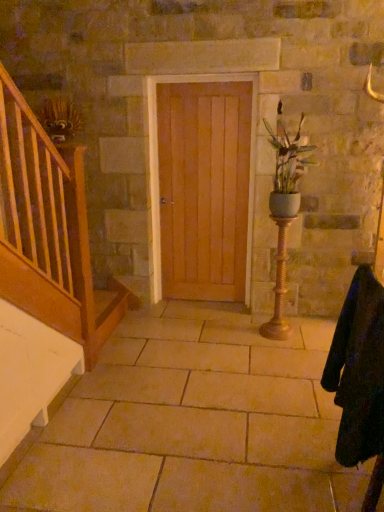
Identify the location of vacant area situated to the left side of gold textured candle holder at center right. (244, 333).